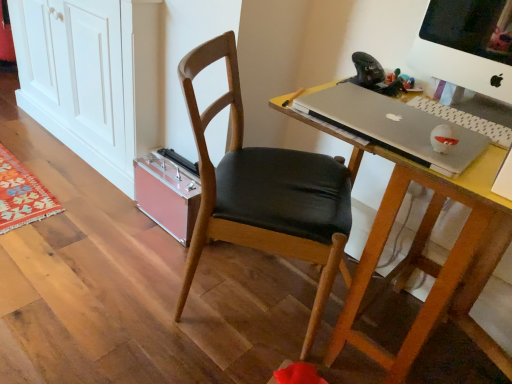
Locate an element on the screen. blank area beneath white plastic computer monitor at upper right (from a real-world perspective) is located at coordinates (474, 110).